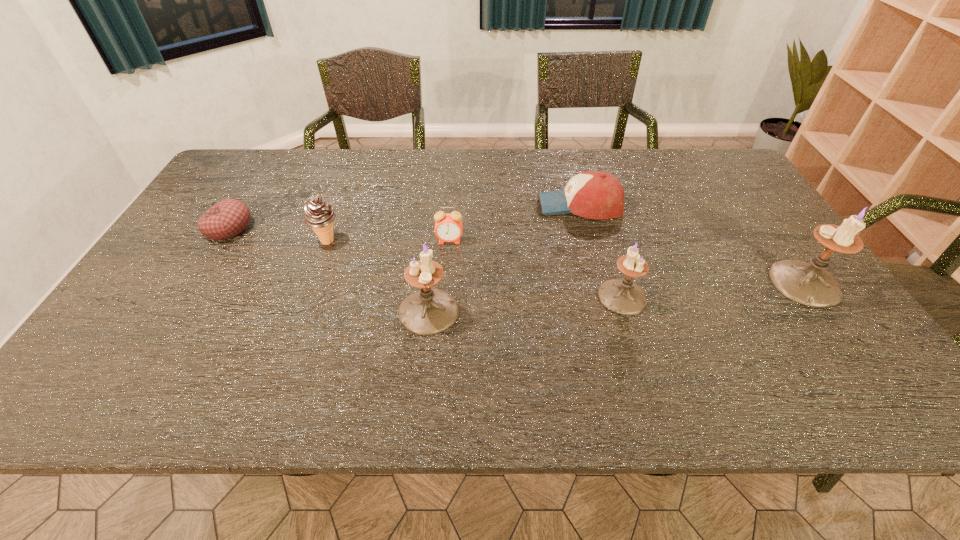
Please point a vacant point for placing a candle holder on the left. Please provide its 2D coordinates. Your answer should be formatted as a tuple, i.e. [(x, y)], where the tuple contains the x and y coordinates of a point satisfying the conditions above.

[(223, 327)]